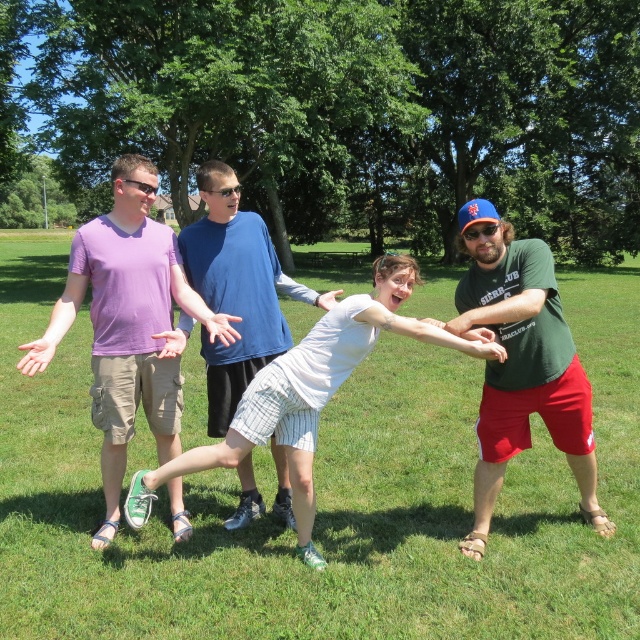
Can you confirm if purple cotton shirt at left is positioned to the right of green matte shirt at center?

Incorrect, purple cotton shirt at left is not on the right side of green matte shirt at center.

Can you confirm if purple cotton shirt at left is wider than green matte shirt at center?

In fact, purple cotton shirt at left might be narrower than green matte shirt at center.

Does point (154, 340) come in front of point (490, 221)?

No, (154, 340) is further to viewer.

Where is `purple cotton shirt at left`? The image size is (640, 640). purple cotton shirt at left is located at coordinates (125, 324).

Is the position of green grass at center more distant than that of green matte shirt at center?

No, it is in front of green matte shirt at center.

Between point (401, 540) and point (538, 316), which one is positioned in front?

Point (538, 316)

Is point (44, 595) closer to camera compared to point (563, 433)?

Yes, point (44, 595) is in front of point (563, 433).

This screenshot has height=640, width=640. I want to click on green grass at center, so click(x=324, y=499).

Does green matte shirt at center appear over white cotton shirt at center?

Yes, green matte shirt at center is above white cotton shirt at center.

Does green matte shirt at center have a lesser width compared to white cotton shirt at center?

Correct, green matte shirt at center's width is less than white cotton shirt at center's.

Who is more forward, (518, 326) or (132, 493)?

Point (518, 326) is more forward.

Locate an element on the screen. green matte shirt at center is located at coordinates (522, 364).